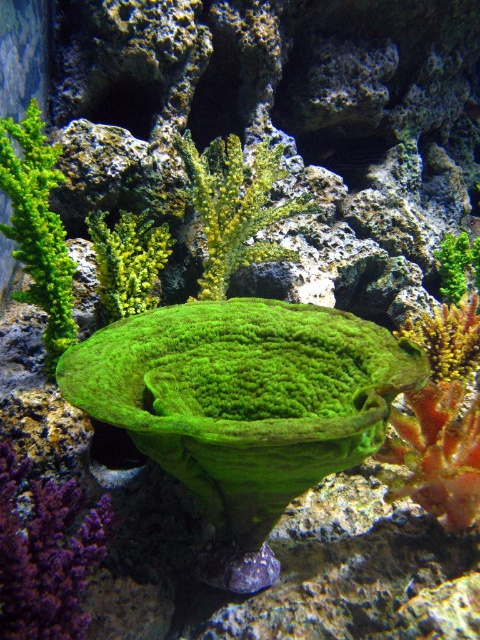
Question: Which point is farther to the camera?

Choices:
 (A) (454, 269)
 (B) (105, 317)
 (C) (63, 637)
 (D) (17, 244)

Answer: (A)

Question: Which object appears farthest from the camera in this image?

Choices:
 (A) green fuzzy coral at upper right
 (B) green fuzzy plant at left
 (C) green fuzzy coral at center
 (D) green mossy rock at lower left

Answer: (A)

Question: Can you confirm if green fuzzy plant at left is positioned above green fuzzy coral at upper right?

Choices:
 (A) yes
 (B) no

Answer: (A)

Question: Observing the image, what is the correct spatial positioning of green fuzzy coral at center in reference to green fuzzy plant at upper center?

Choices:
 (A) below
 (B) above

Answer: (B)

Question: Is green mossy rock at lower left below green fuzzy plant at upper center?

Choices:
 (A) yes
 (B) no

Answer: (A)

Question: Which object is the farthest from the green fuzzy coral at center?

Choices:
 (A) green mossy rock at lower left
 (B) green fuzzy coral at upper right
 (C) green fuzzy plant at left
 (D) green fuzzy plant at upper center

Answer: (A)